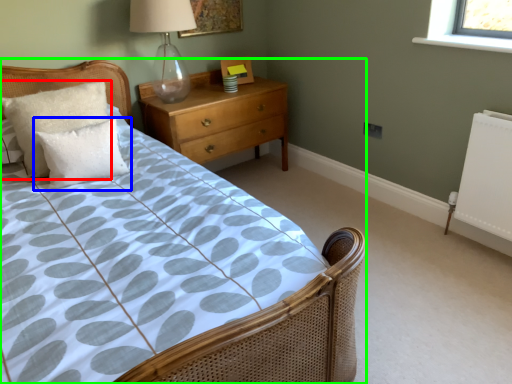
Question: Which is nearer to the pillow (highlighted by a red box)? pillow (highlighted by a blue box) or bed (highlighted by a green box).

Choices:
 (A) pillow
 (B) bed

Answer: (A)